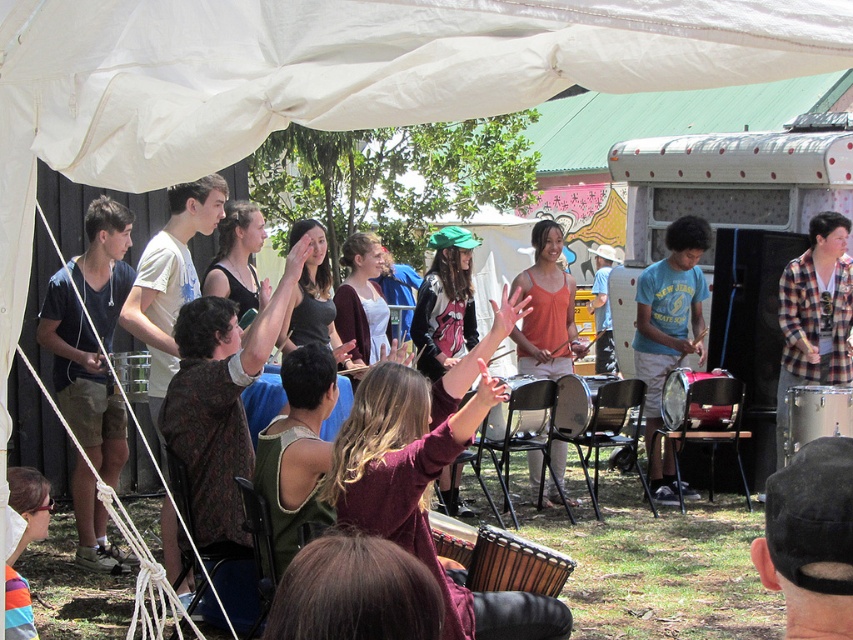
Who is more distant from viewer, (x=51, y=304) or (x=651, y=449)?

Positioned behind is point (x=651, y=449).

Does point (108, 544) come behind point (647, 384)?

No, it is not.

At what (x,y) coordinates should I click in order to perform the action: click on dark blue t-shirt at left. Please return your answer as a coordinate pair (x, y). Image resolution: width=853 pixels, height=640 pixels. Looking at the image, I should click on (90, 336).

Is black fabric cap at lower right thinner than blue cotton t-shirt at center?

Correct, black fabric cap at lower right's width is less than blue cotton t-shirt at center's.

This screenshot has width=853, height=640. Describe the element at coordinates (810, 540) in the screenshot. I see `black fabric cap at lower right` at that location.

The height and width of the screenshot is (640, 853). I want to click on black fabric cap at lower right, so click(x=810, y=540).

Does dark brown textured shirt at center have a lesser width compared to rainbow striped shirt at lower left?

No.

Does dark brown textured shirt at center have a lesser height compared to rainbow striped shirt at lower left?

In fact, dark brown textured shirt at center may be taller than rainbow striped shirt at lower left.

Does point (212, 490) lie behind point (15, 588)?

That is True.

The width and height of the screenshot is (853, 640). What are the coordinates of `dark brown textured shirt at center` in the screenshot? It's located at (219, 401).